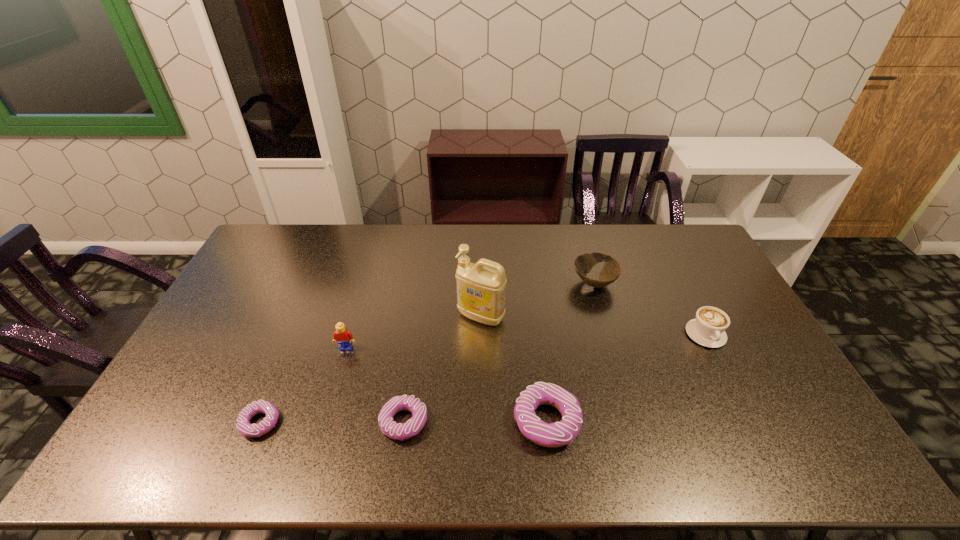
Find the location of a particular element. the sixth shortest object is located at coordinates (344, 338).

Identify the location of the second object from left to right. (344, 338).

Locate an element on the screen. This screenshot has width=960, height=540. the rightmost object is located at coordinates (708, 329).

Identify the location of free space located on the back of the shortest object. (282, 369).

Where is `vacant space located 0.300m on the left of the fifth object from right to left`? This screenshot has width=960, height=540. vacant space located 0.300m on the left of the fifth object from right to left is located at coordinates (262, 422).

At what (x,y) coordinates should I click in order to perform the action: click on free space located on the left of the rightmost doughnut. Please return your answer as a coordinate pair (x, y). Looking at the image, I should click on (369, 421).

Identify the location of vacant space located on the front of the bowl. (610, 337).

This screenshot has width=960, height=540. I want to click on free region located 0.110m on the front of the tallest object, so click(x=481, y=359).

The image size is (960, 540). I want to click on blank space located 0.190m on the front-facing side of the second tallest object, so click(329, 408).

The width and height of the screenshot is (960, 540). What are the coordinates of `free region located to the right of the cappuccino's handle` in the screenshot? It's located at (739, 400).